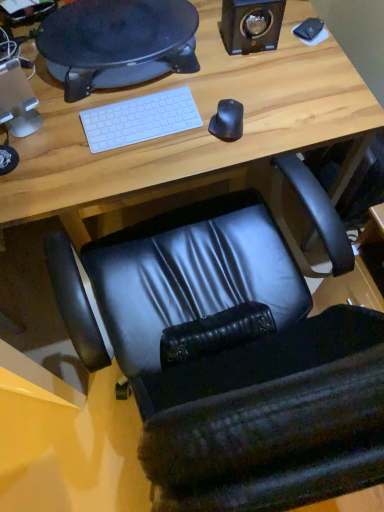
The image size is (384, 512). What are the coordinates of `empty space that is to the right of white matte keyboard at center` in the screenshot? It's located at (212, 118).